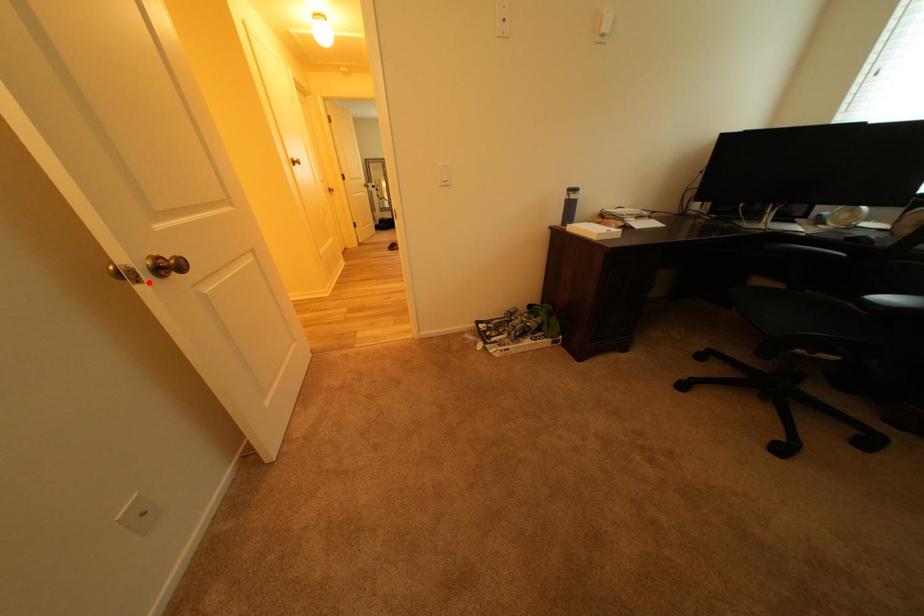
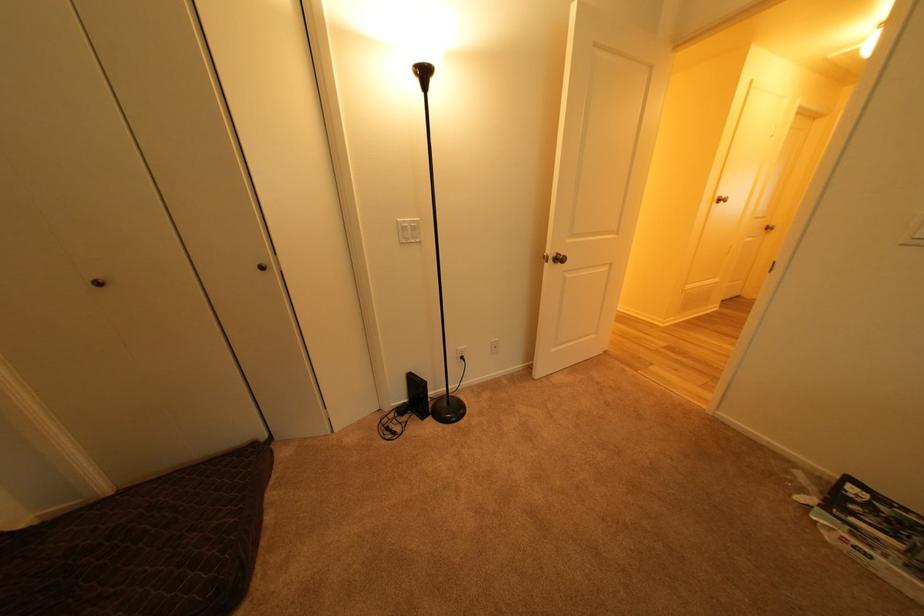
The point at the highlighted location is marked in the first image. Where is the corresponding point in the second image?

(557, 264)